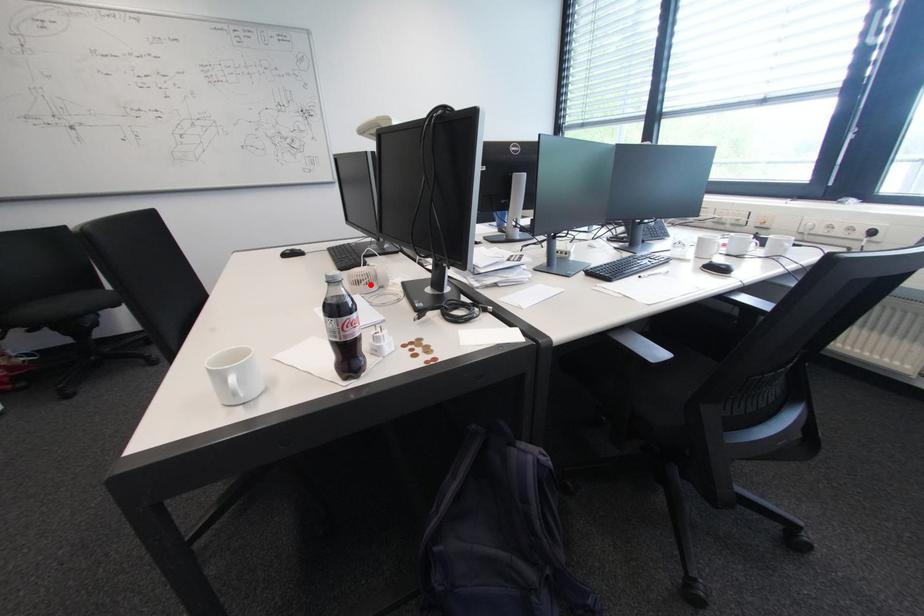
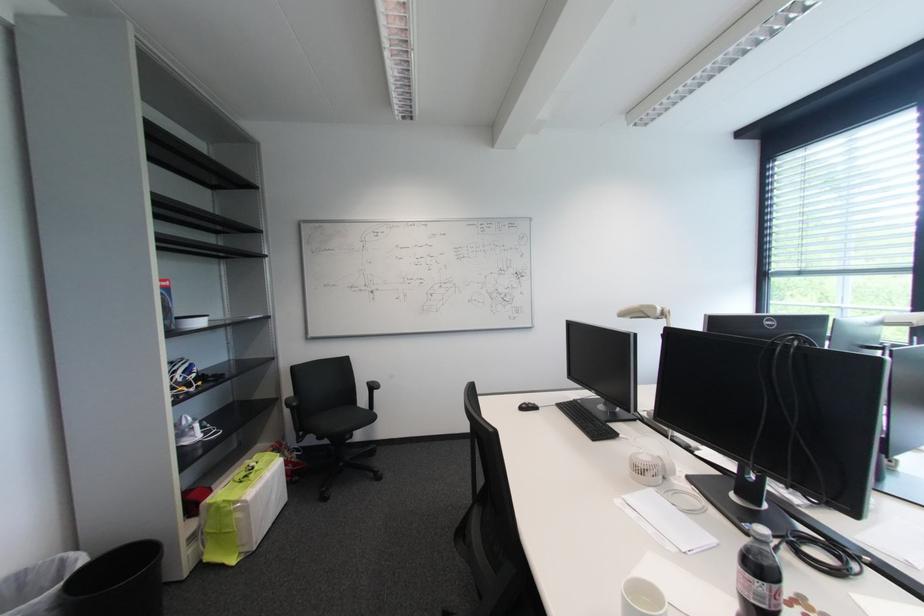
The point at the highlighted location is marked in the first image. Where is the corresponding point in the second image?

(657, 475)